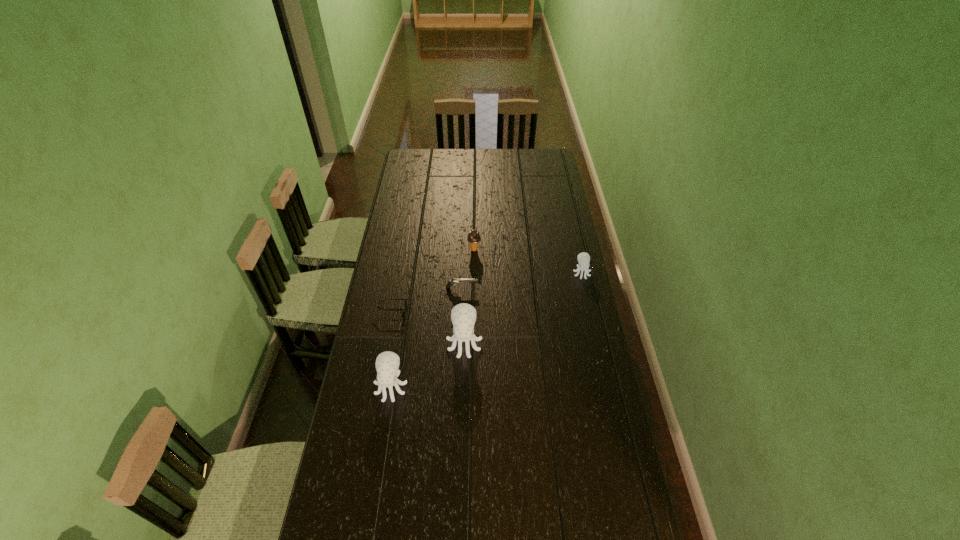
Image resolution: width=960 pixels, height=540 pixels. I want to click on the leftmost octopus, so click(387, 363).

Identify the location of the second tallest octopus. This screenshot has height=540, width=960. (387, 363).

This screenshot has height=540, width=960. In order to click on the second nearest object in this screenshot , I will do `click(463, 316)`.

The image size is (960, 540). What are the coordinates of `the second octopus from right to left` in the screenshot? It's located at (463, 316).

The width and height of the screenshot is (960, 540). Identify the location of the fifth nearest object. 583,258.

You are a GUI agent. You are given a task and a screenshot of the screen. Output one action in this format:
    pyautogui.click(x=<x>, y=<y>)
    Task: Click on the farthest octopus
    Image resolution: width=960 pixels, height=540 pixels.
    Given the screenshot: What is the action you would take?
    pyautogui.click(x=583, y=258)

Image resolution: width=960 pixels, height=540 pixels. What are the coordinates of `the fourth shortest object` in the screenshot? It's located at (474, 238).

In order to click on icecream in this screenshot , I will do `click(474, 238)`.

Identify the location of pistol. (452, 281).

Find the location of a particular element. This screenshot has width=960, height=540. the third farthest object is located at coordinates (452, 281).